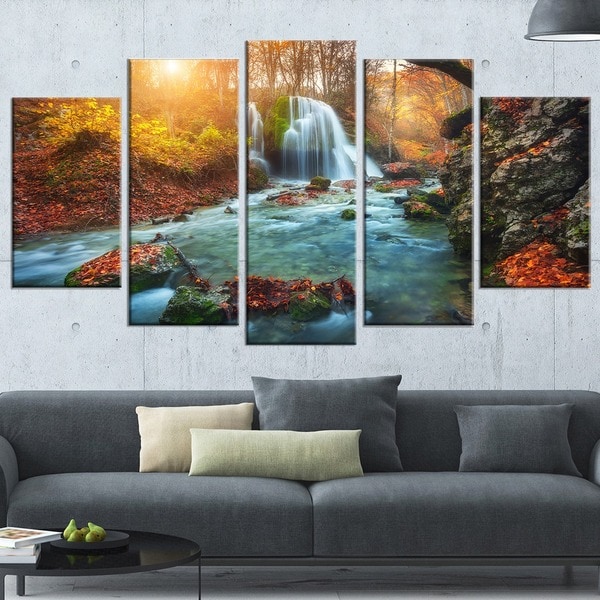
Find the location of a particular element. left couch cushion is located at coordinates (451, 514).